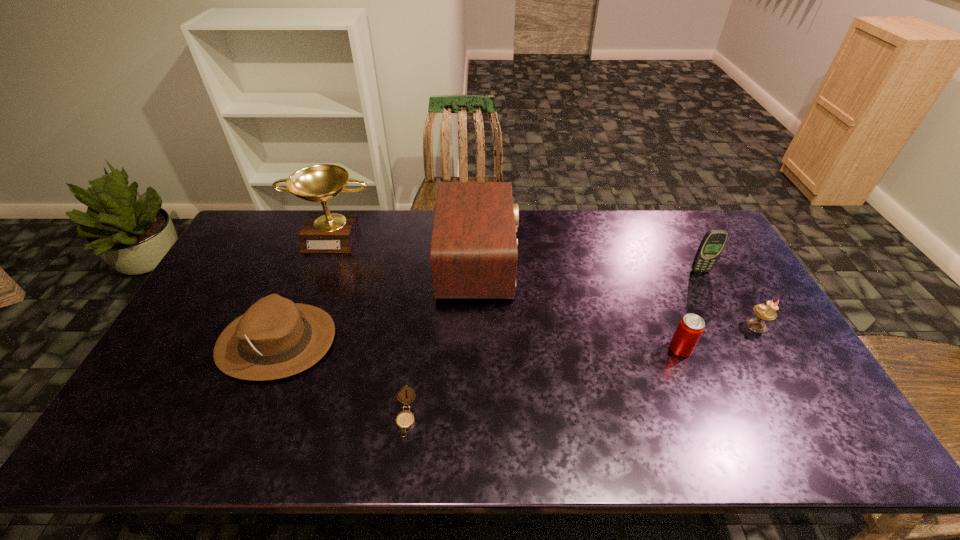
Identify the location of vacant point located between the cellular telephone and the radio receiver. (589, 267).

Locate an element on the screen. free spot between the can and the fedora is located at coordinates (479, 345).

Identify the location of vacant space that's between the fifth object from left to right and the sixth object from left to right. (690, 310).

You are a GUI agent. You are given a task and a screenshot of the screen. Output one action in this format:
    pyautogui.click(x=<x>, y=<y>)
    Task: Click on the vacant area that lies between the fedora and the compass
    The height and width of the screenshot is (540, 960).
    Given the screenshot: What is the action you would take?
    pyautogui.click(x=342, y=380)

Where is `the closest object relative to the award`? This screenshot has height=540, width=960. the closest object relative to the award is located at coordinates (473, 254).

Identify the location of object that is the fifth closest to the fedora. (714, 241).

Identify the location of vacant space that satisfies the following two spatial constraints: 1. on the front-facing side of the award; 2. on the feather side of the fedora. This screenshot has width=960, height=540. (292, 341).

Find the location of a particular element. The height and width of the screenshot is (540, 960). free space that satisfies the following two spatial constraints: 1. on the front panel of the can; 2. on the left side of the radio receiver is located at coordinates (478, 349).

Where is `vacant point that satisfies the following two spatial constraints: 1. on the back side of the fifth object from left to right; 2. on the feather side of the fedora`? vacant point that satisfies the following two spatial constraints: 1. on the back side of the fifth object from left to right; 2. on the feather side of the fedora is located at coordinates (678, 341).

The height and width of the screenshot is (540, 960). What are the coordinates of `free space in the image that satisfies the following two spatial constraints: 1. on the front panel of the radio receiver; 2. on the back side of the can` in the screenshot? It's located at (478, 349).